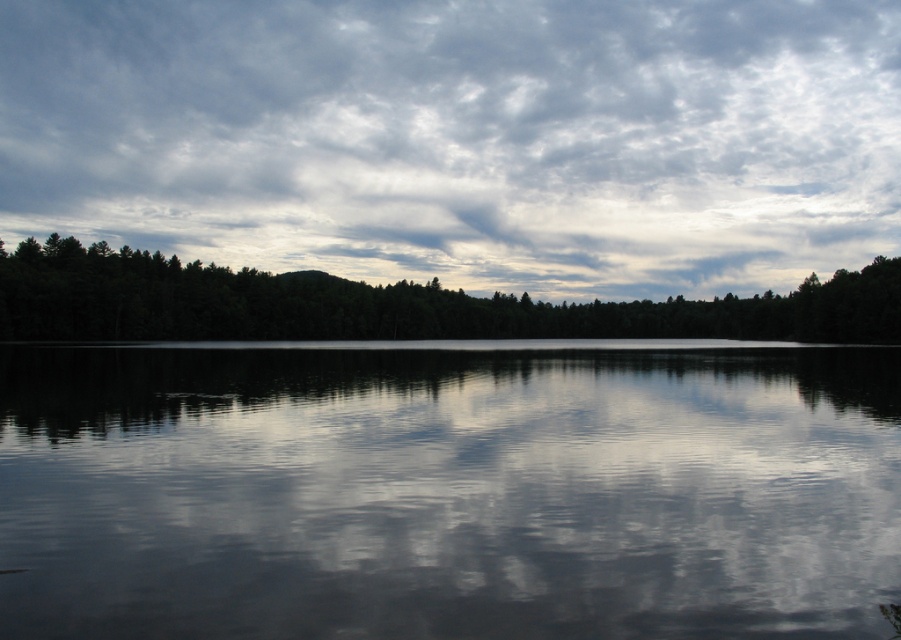
You are standing at the edge of the scene and want to walk towards the green matte forest at center. Which direction should you face to move directly towards it without crossing the smooth water at center?

Since the smooth water at center is to the left of the green matte forest at center, you should face to the right to move directly towards the green matte forest at center without crossing the smooth water at center.

Based on the coordinates provided, can you identify which object is located at point (447, 492)?

The smooth water at center is located at point (447, 492).